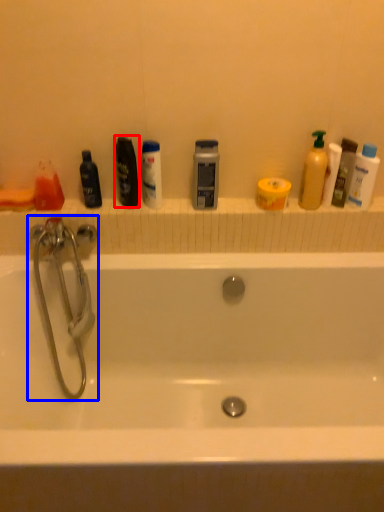
Question: Among these objects, which one is farthest to the camera, mouthwash (highlighted by a red box) or tap (highlighted by a blue box)?

Choices:
 (A) mouthwash
 (B) tap

Answer: (A)